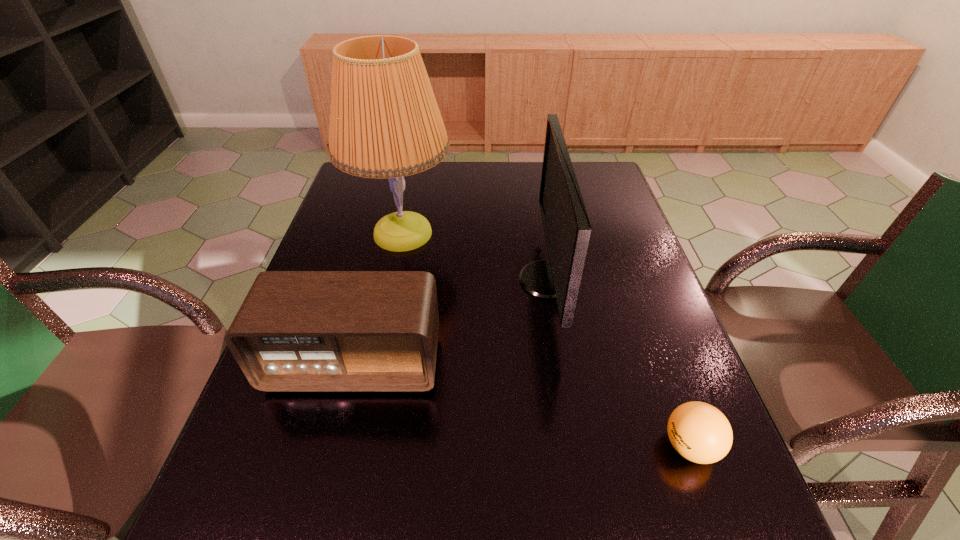
Locate an element on the screen. The height and width of the screenshot is (540, 960). vacant point located between the shortest object and the third shortest object is located at coordinates (618, 363).

Locate which object is the third closest to the tallest object. Please provide its 2D coordinates. Your answer should be formatted as a tuple, i.e. [(x, y)], where the tuple contains the x and y coordinates of a point satisfying the conditions above.

[(698, 431)]

Select which object is the second closest to the rightmost object. Please provide its 2D coordinates. Your answer should be formatted as a tuple, i.e. [(x, y)], where the tuple contains the x and y coordinates of a point satisfying the conditions above.

[(296, 330)]

At what (x,y) coordinates should I click in order to perform the action: click on vacant area that satisfies the following two spatial constraints: 1. on the front-facing side of the third shortest object; 2. on the front-facing side of the third tallest object. Please return your answer as a coordinate pair (x, y). Looking at the image, I should click on (561, 363).

The width and height of the screenshot is (960, 540). I want to click on free spot that satisfies the following two spatial constraints: 1. on the front-facing side of the third object from left to right; 2. on the front-facing side of the second shortest object, so click(x=561, y=363).

Locate an element on the screen. vacant point that satisfies the following two spatial constraints: 1. on the side of the lamp near the pull switch; 2. on the front-facing side of the third tallest object is located at coordinates (375, 363).